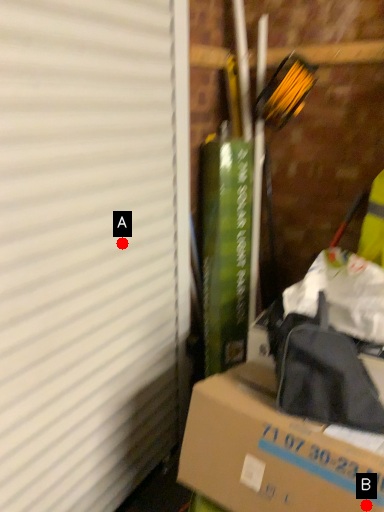
Question: Two points are circled on the image, labeled by A and B beside each circle. Which point appears closest to the camera in this image?

Choices:
 (A) A is closer
 (B) B is closer

Answer: (B)